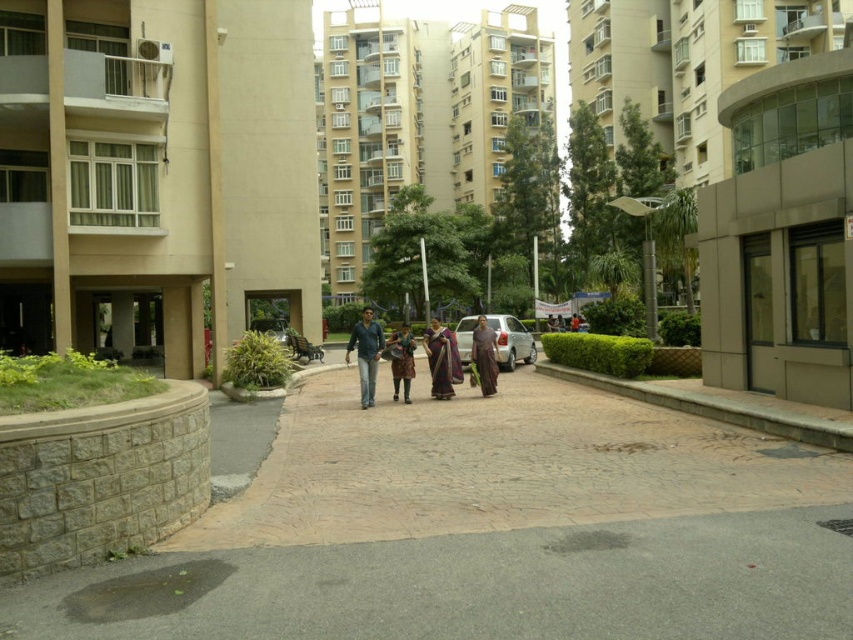
Who is positioned more to the right, brown textured pavement at center or satin silver car at center?

Positioned to the right is satin silver car at center.

Is brown textured pavement at center to the left of satin silver car at center from the viewer's perspective?

Indeed, brown textured pavement at center is positioned on the left side of satin silver car at center.

Is point (624, 625) farther from camera compared to point (508, 339)?

No, (624, 625) is in front of (508, 339).

The width and height of the screenshot is (853, 640). In order to click on brown textured pavement at center in this screenshot , I will do `click(486, 531)`.

Is beige concrete building at left smaller than brown fabric saree at center?

No.

Does beige concrete building at left appear on the left side of brown fabric saree at center?

Correct, you'll find beige concrete building at left to the left of brown fabric saree at center.

Does point (236, 280) lie in front of point (488, 380)?

That is False.

At what (x,y) coordinates should I click in order to perform the action: click on beige concrete building at left. Please return your answer as a coordinate pair (x, y). Looking at the image, I should click on (155, 170).

Can you confirm if purple silk saree at center is wider than brown fabric pants at center?

No, purple silk saree at center is not wider than brown fabric pants at center.

Who is more forward, (434, 392) or (401, 365)?

Point (401, 365) is in front.

Identify the location of purple silk saree at center. (440, 358).

You are a GUI agent. You are given a task and a screenshot of the screen. Output one action in this format:
    pyautogui.click(x=<x>, y=<y>)
    Task: Click on the purple silk saree at center
    The height and width of the screenshot is (640, 853).
    Given the screenshot: What is the action you would take?
    pyautogui.click(x=440, y=358)